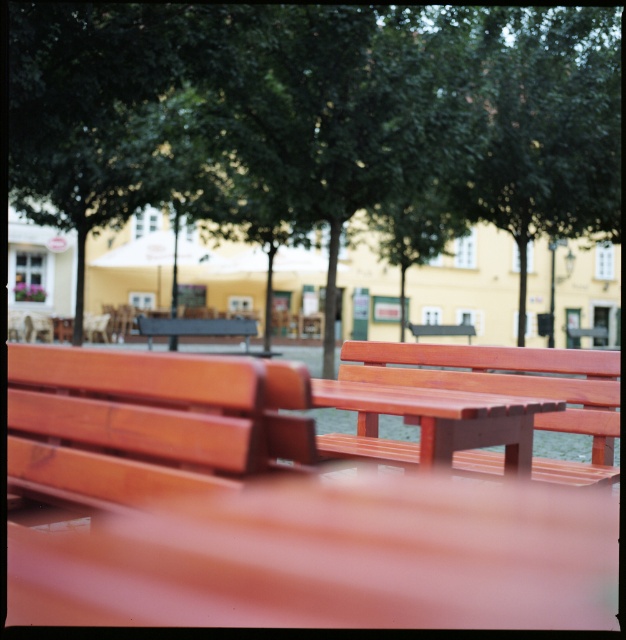
Does green leafy tree at center have a larger size compared to matte black bench at center?

Indeed, green leafy tree at center has a larger size compared to matte black bench at center.

Is point (275, 60) closer to camera compared to point (190, 324)?

Yes.

Which is behind, point (83, 33) or point (240, 324)?

Positioned behind is point (240, 324).

Locate an element on the screen. green leafy tree at center is located at coordinates (344, 102).

Can you confirm if wooden table at center is positioned to the left of matte black bench at center?

Incorrect, wooden table at center is not on the left side of matte black bench at center.

Which of these two, wooden table at center or matte black bench at center, stands taller?

Standing taller between the two is matte black bench at center.

Which is in front, point (423, 394) or point (145, 333)?

Point (423, 394) is more forward.

The image size is (626, 640). I want to click on wooden table at center, so point(441,419).

Who is lower down, green leafy tree at center or matte wood bench at center?

matte wood bench at center

In the scene shown: Who is more distant from viewer, (x=470, y=157) or (x=222, y=465)?

The point (x=470, y=157) is more distant.

Does point (481, 154) come farther from viewer compared to point (110, 500)?

Yes, point (481, 154) is farther from viewer.

Identify the location of green leafy tree at center. The image size is (626, 640). pyautogui.click(x=344, y=102).